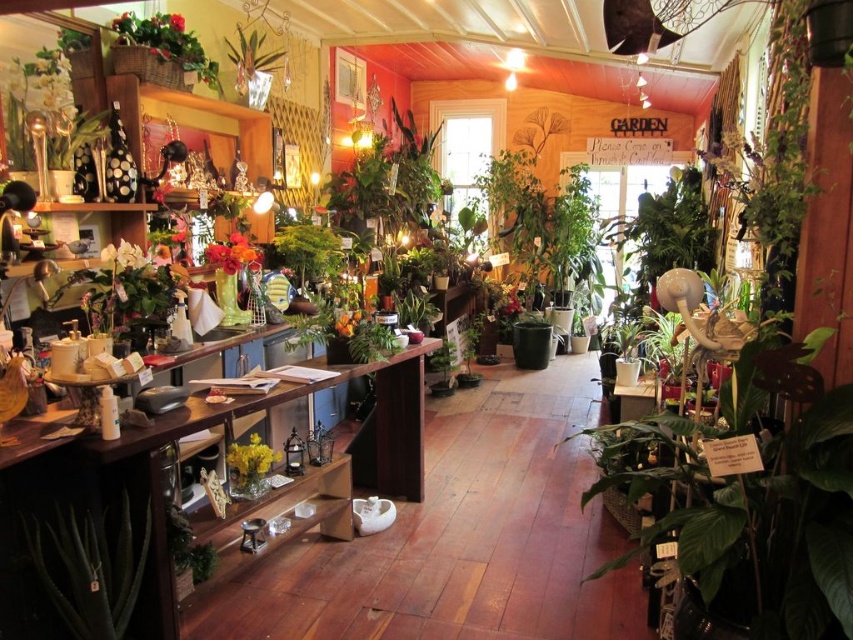
Question: Can you confirm if wooden shelf at lower left is smaller than white matte flower at left?

Choices:
 (A) yes
 (B) no

Answer: (B)

Question: Based on their relative distances, which object is nearer to the green wicker basket at upper left?

Choices:
 (A) wooden shelf at lower left
 (B) yellow matte vase at center

Answer: (B)

Question: Is wooden shelf at lower left positioned in front of matte orange vase at center?

Choices:
 (A) no
 (B) yes

Answer: (B)

Question: Based on their relative distances, which object is farther from the yellow matte vase at center?

Choices:
 (A) white matte flower at left
 (B) green wicker basket at upper left
 (C) matte orange vase at center

Answer: (B)

Question: Is green wicker basket at upper left smaller than yellow matte vase at center?

Choices:
 (A) no
 (B) yes

Answer: (A)

Question: Which object is closer to the camera taking this photo?

Choices:
 (A) wooden shelf at lower left
 (B) matte orange vase at center

Answer: (A)